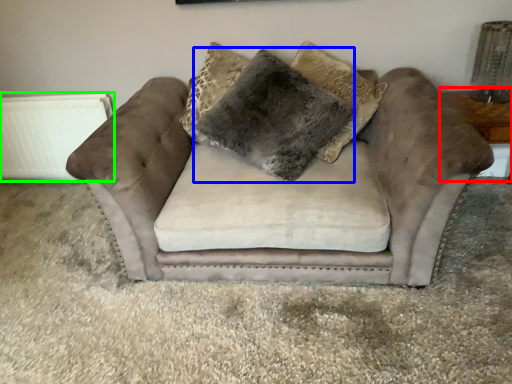
Question: Estimate the real-world distances between objects in this image. Which object is closer to table (highlighted by a red box), pillow (highlighted by a blue box) or radiator (highlighted by a green box)?

Choices:
 (A) pillow
 (B) radiator

Answer: (A)